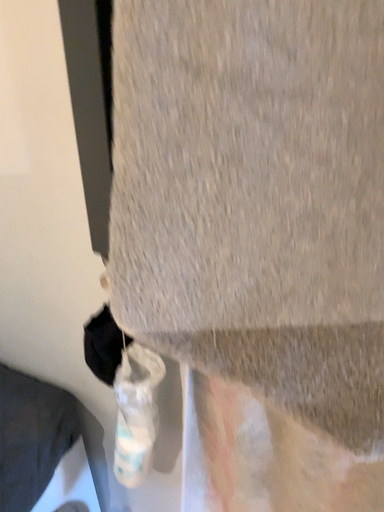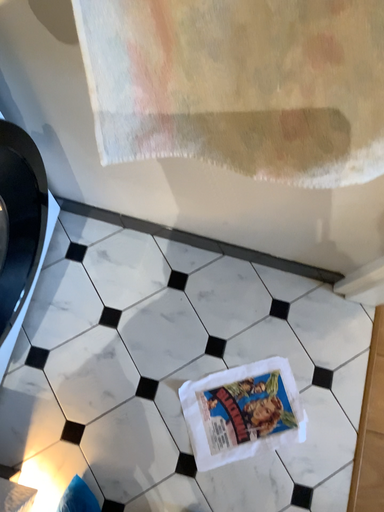
Question: Which way did the camera rotate in the video?

Choices:
 (A) rotated downward
 (B) rotated upward

Answer: (A)